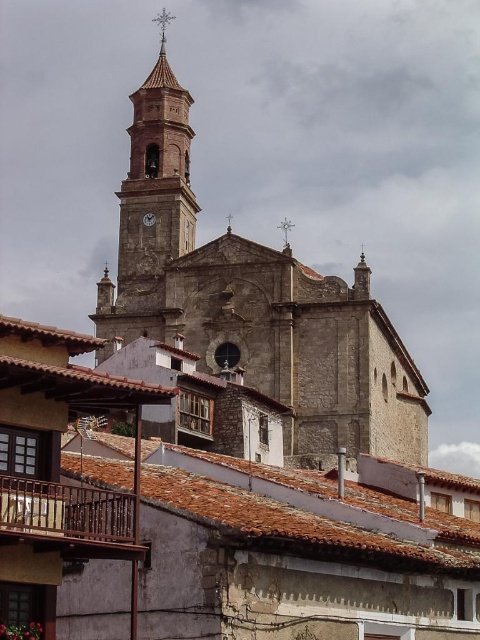
Consider the image. You are standing in front of the historic stone church and want to take a photo that captures both the silver metallic spire at upper center and the metallic clock at center. Which object should you focus on first to ensure both are in the frame?

You should focus on the metallic clock at center first because the silver metallic spire at upper center is closer to the viewer than the metallic clock at center, so adjusting focus starting from the farther object would help include both in the frame.

You are a tourist standing in front of the stone church at center and the metallic clock at center. You want to take a photo that includes both objects. Which object should you focus on to ensure both are in the frame?

Since the stone church at center is taller than the metallic clock at center, you should focus on the stone church at center to ensure both are in the frame as it is the taller object.

You are an architect designing a new plaza in front of the stone church at center and the metallic clock at center. You need to ensure that the plaza can accommodate both structures. Based on their widths, which structure requires more space along the width dimension?

The stone church at center is wider than the metallic clock at center, so it requires more space along the width dimension.